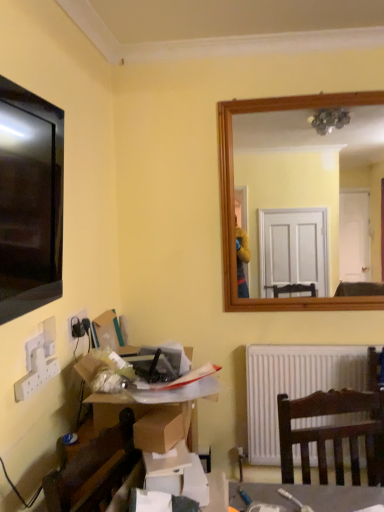
Question: Should I look upward or downward to see black plastic socket at lower left?

Choices:
 (A) up
 (B) down

Answer: (B)

Question: Would you say cardboard box at lower left is a long distance from white matte radiator at lower center?

Choices:
 (A) no
 (B) yes

Answer: (A)

Question: Does cardboard box at lower left have a larger size compared to white matte radiator at lower center?

Choices:
 (A) yes
 (B) no

Answer: (A)

Question: Can you confirm if cardboard box at lower left is positioned to the left of white matte radiator at lower center?

Choices:
 (A) yes
 (B) no

Answer: (A)

Question: From the image's perspective, would you say cardboard box at lower left is positioned over white matte radiator at lower center?

Choices:
 (A) no
 (B) yes

Answer: (B)

Question: From a real-world perspective, is cardboard box at lower left positioned under white matte radiator at lower center based on gravity?

Choices:
 (A) no
 (B) yes

Answer: (A)

Question: From the image's perspective, is cardboard box at lower left under white matte radiator at lower center?

Choices:
 (A) no
 (B) yes

Answer: (A)

Question: Is black plastic socket at lower left placed right next to white matte radiator at lower center?

Choices:
 (A) no
 (B) yes

Answer: (A)

Question: Can you confirm if black plastic socket at lower left is shorter than white matte radiator at lower center?

Choices:
 (A) yes
 (B) no

Answer: (A)

Question: Is black plastic socket at lower left closer to camera compared to white matte radiator at lower center?

Choices:
 (A) yes
 (B) no

Answer: (A)

Question: Considering the relative sizes of black plastic socket at lower left and white matte radiator at lower center in the image provided, is black plastic socket at lower left bigger than white matte radiator at lower center?

Choices:
 (A) yes
 (B) no

Answer: (B)

Question: Is black plastic socket at lower left thinner than white matte radiator at lower center?

Choices:
 (A) no
 (B) yes

Answer: (B)

Question: Does black plastic socket at lower left appear on the right side of white matte radiator at lower center?

Choices:
 (A) yes
 (B) no

Answer: (B)

Question: Is white matte radiator at lower center shorter than black plastic socket at lower left?

Choices:
 (A) yes
 (B) no

Answer: (B)